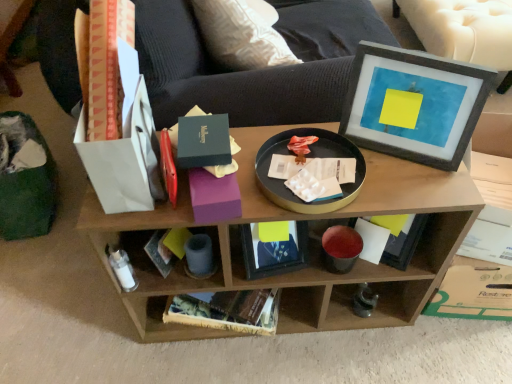
Where is `vacant space underneath black matte tray at center (from a real-world perspective)`? The width and height of the screenshot is (512, 384). vacant space underneath black matte tray at center (from a real-world perspective) is located at coordinates (307, 180).